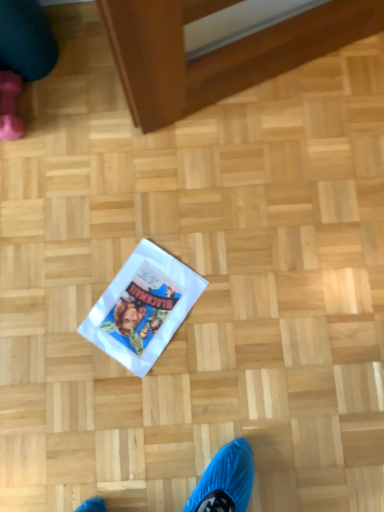
You are a GUI agent. You are given a task and a screenshot of the screen. Output one action in this format:
    pyautogui.click(x=<x>, y=<y>)
    Task: Click on the vacant space to the right of teal fabric leg at upper left
    This screenshot has height=512, width=384.
    Given the screenshot: What is the action you would take?
    pyautogui.click(x=90, y=60)